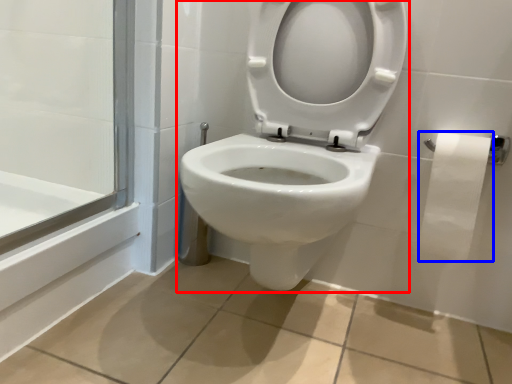
Question: Which object appears farthest to the camera in this image, toilet (highlighted by a red box) or toilet paper (highlighted by a blue box)?

Choices:
 (A) toilet
 (B) toilet paper

Answer: (B)